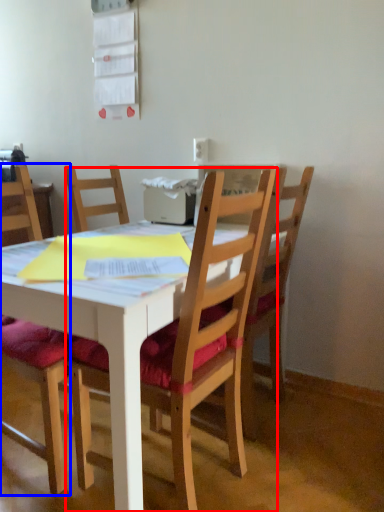
Question: Which object is further to the camera taking this photo, chair (highlighted by a red box) or chair (highlighted by a blue box)?

Choices:
 (A) chair
 (B) chair

Answer: (B)